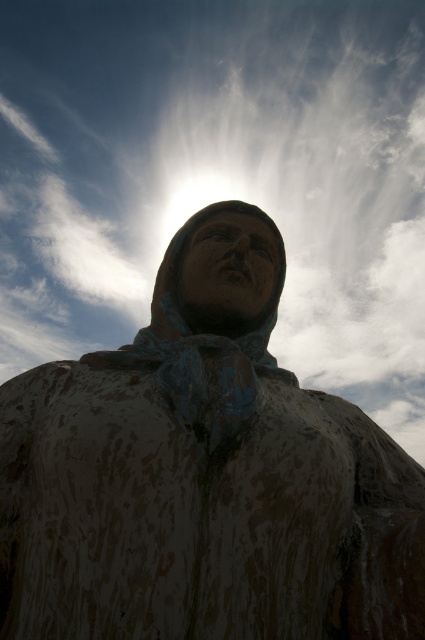
Question: Does white fluffy cloud at upper center appear on the left side of rusty metal statue at center?

Choices:
 (A) yes
 (B) no

Answer: (B)

Question: Can you confirm if white fluffy cloud at upper center is wider than rusty metal statue at center?

Choices:
 (A) yes
 (B) no

Answer: (A)

Question: Which of the following is the closest to the observer?

Choices:
 (A) white fluffy cloud at upper center
 (B) rusty metal statue at center

Answer: (B)

Question: Observing the image, what is the correct spatial positioning of white fluffy cloud at upper center in reference to rusty metal statue at center?

Choices:
 (A) above
 (B) below

Answer: (A)